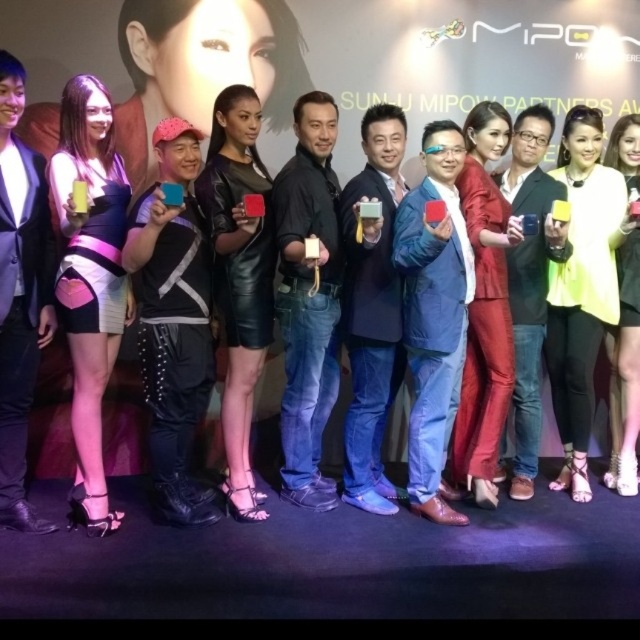
Question: Which of these objects is positioned farthest from the matte black phone at center?

Choices:
 (A) black leather jacket at center
 (B) leather jacket at center
 (C) yellow matte dress at center

Answer: (A)

Question: Does matte black dress at center have a lesser width compared to matte black suit at center?

Choices:
 (A) yes
 (B) no

Answer: (B)

Question: Among these points, which one is nearest to the camera?

Choices:
 (A) (435, 301)
 (B) (500, 147)

Answer: (A)

Question: Is matte black suit at center above pink satin dress at center?

Choices:
 (A) yes
 (B) no

Answer: (B)

Question: Can you confirm if matte blue suit at center is bigger than matte black suit at center?

Choices:
 (A) no
 (B) yes

Answer: (B)

Question: Among these objects, which one is nearest to the camera?

Choices:
 (A) matte blue suit at center
 (B) black leather jacket at center

Answer: (B)